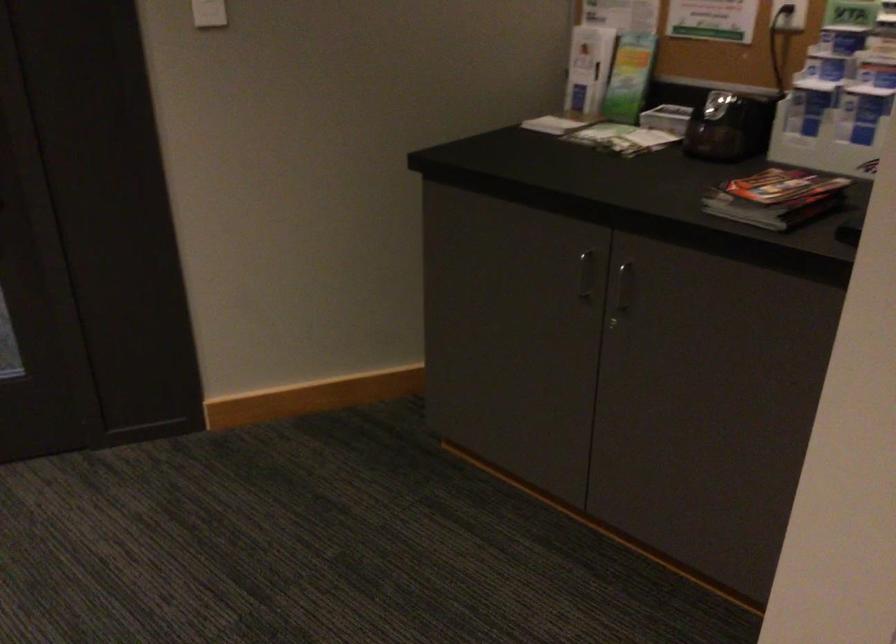
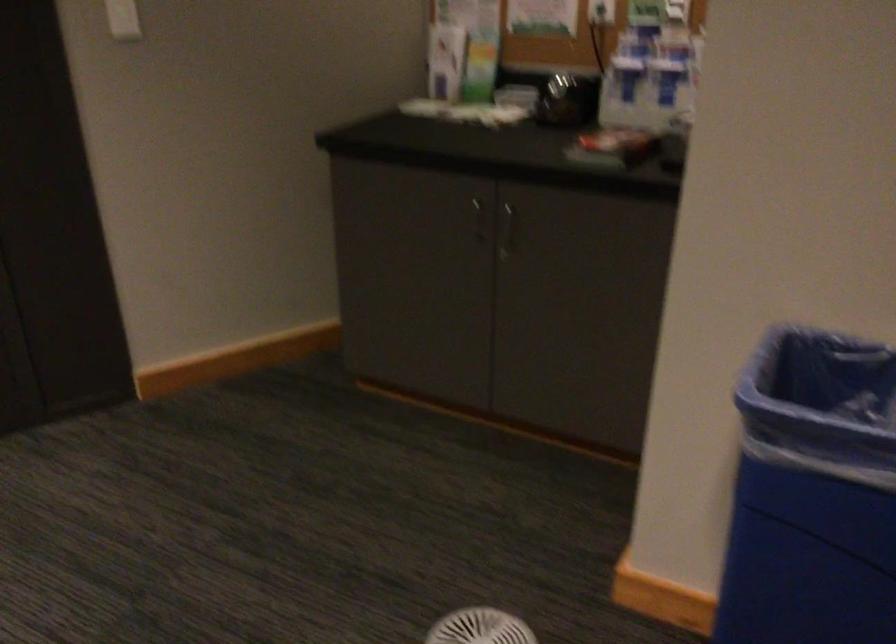
Question: The camera is either moving clockwise (left) or counter-clockwise (right) around the object. The first image is from the beginning of the video and the second image is from the end. Is the camera moving left or right when shooting the video?

Choices:
 (A) Left
 (B) Right

Answer: (A)